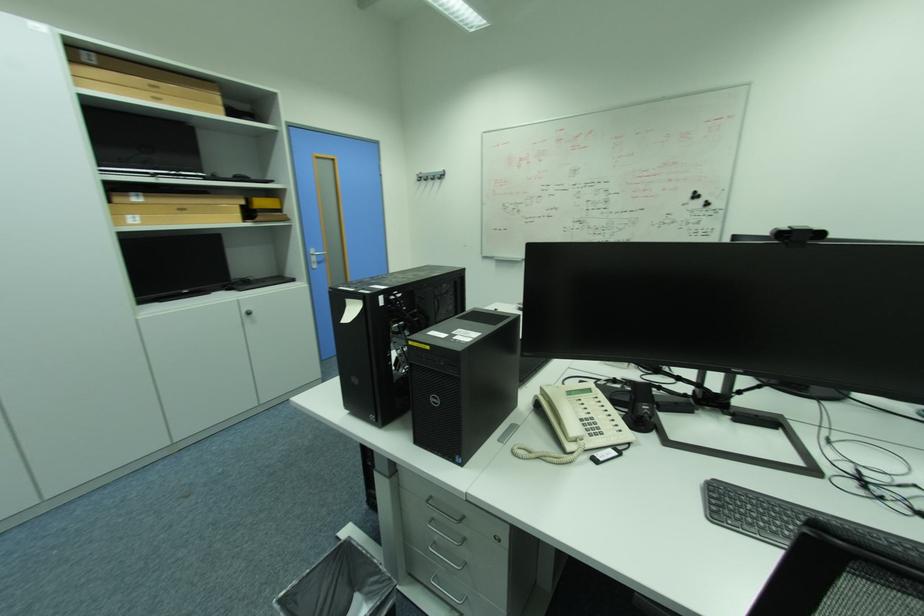
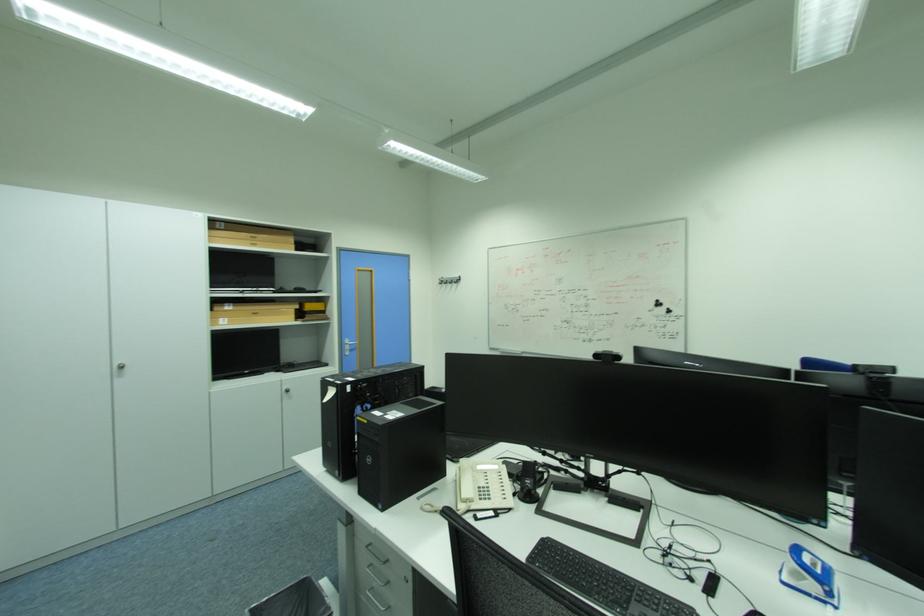
The point at (246,301) is marked in the first image. Where is the corresponding point in the second image?

(289, 379)